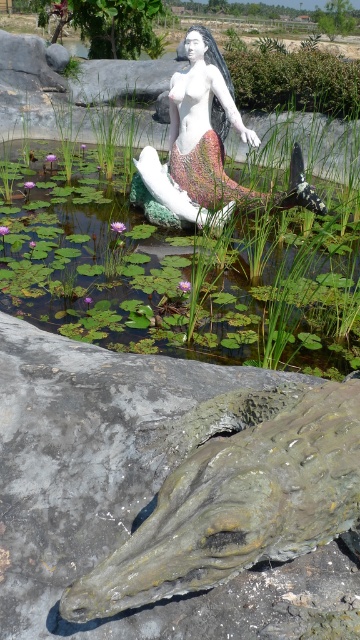
The height and width of the screenshot is (640, 360). I want to click on green leafy water at center, so click(x=176, y=273).

Is green leafy water at center positioned before gray rough stone at lower center?

No, it is not.

Who is more forward, (306, 289) or (51, 554)?

Point (51, 554) is more forward.

Locate an element on the screen. This screenshot has height=640, width=360. green leafy water at center is located at coordinates (176, 273).

Is gray rough stone at lower center to the left of white glossy mermaid at center from the viewer's perspective?

Indeed, gray rough stone at lower center is positioned on the left side of white glossy mermaid at center.

Locate an element on the screen. This screenshot has width=360, height=640. gray rough stone at lower center is located at coordinates (122, 493).

Locate an element on the screen. gray rough stone at lower center is located at coordinates (122, 493).

Between green leafy water at center and white glossy mermaid at center, which one has more height?

green leafy water at center

Is green leafy water at center taller than white glossy mermaid at center?

Correct, green leafy water at center is much taller as white glossy mermaid at center.

Is point (221, 300) positioned after point (196, 221)?

No, it is in front of (196, 221).

I want to click on green leafy water at center, so click(x=176, y=273).